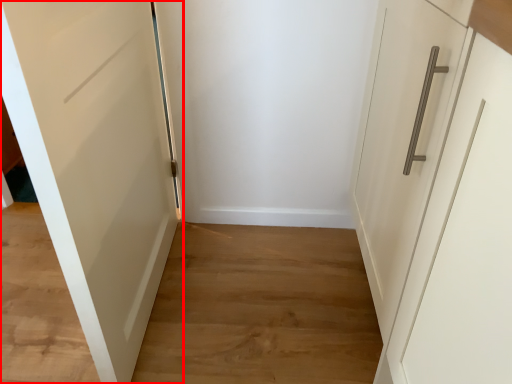
Question: From the image's perspective, what is the correct spatial relationship of door (annotated by the red box) in relation to path?

Choices:
 (A) above
 (B) below

Answer: (A)